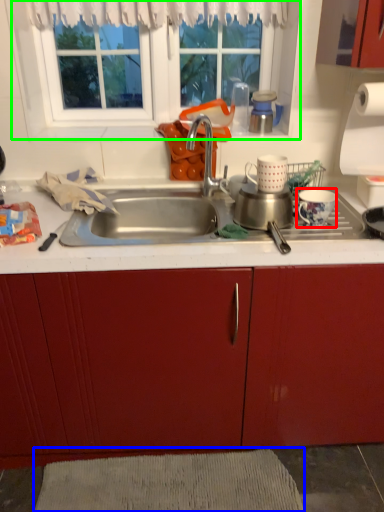
Question: Considering the real-world distances, which object is closest to coffee cup (highlighted by a red box)? plain (highlighted by a blue box) or window (highlighted by a green box).

Choices:
 (A) plain
 (B) window

Answer: (B)